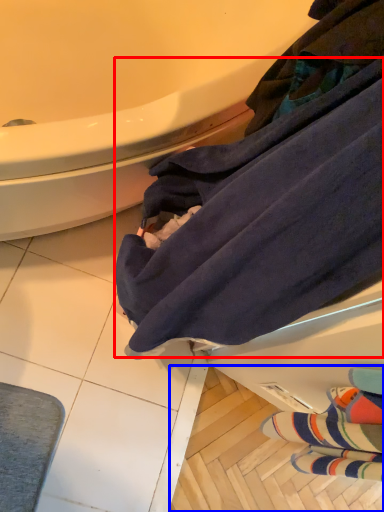
Question: Which object appears closest to the camera in this image, bath towel (highlighted by a red box) or tile (highlighted by a blue box)?

Choices:
 (A) bath towel
 (B) tile

Answer: (A)